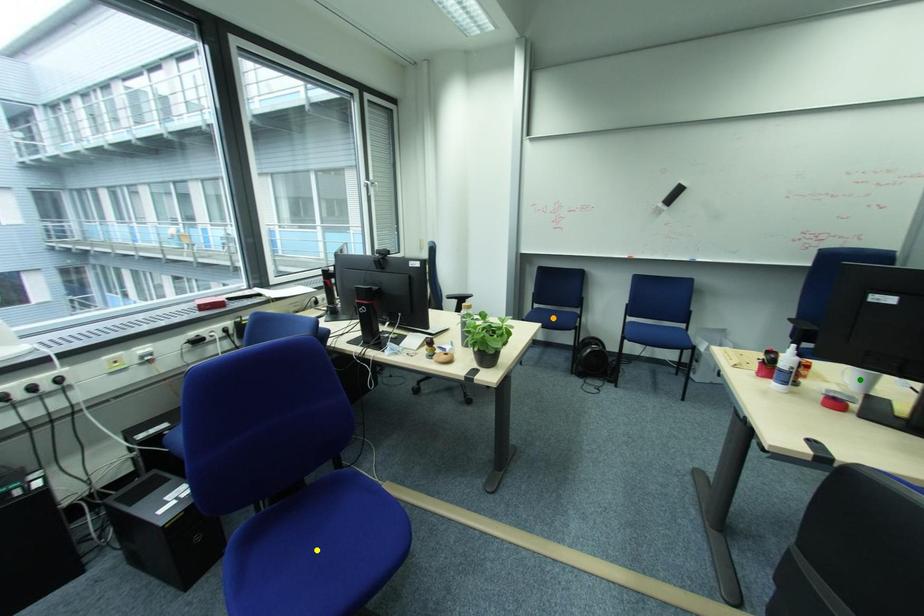
Order these from nearest to farthest:
- green point
- orange point
- yellow point

green point
yellow point
orange point